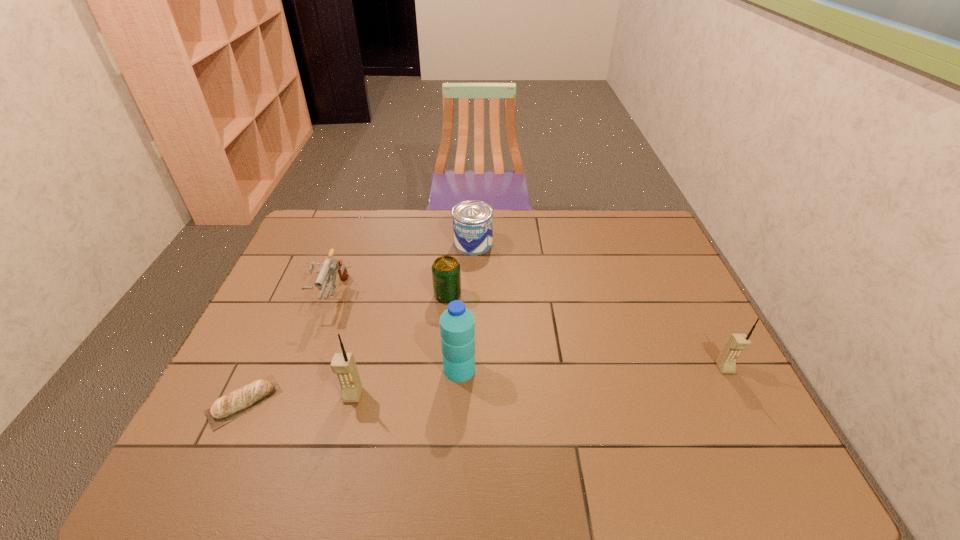
At what (x,y) coordinates should I click in order to perform the action: click on the left cellular telephone. Please return your answer as a coordinate pair (x, y). Looking at the image, I should click on (343, 364).

Image resolution: width=960 pixels, height=540 pixels. I want to click on the taller cellular telephone, so click(x=343, y=364).

This screenshot has width=960, height=540. Find the location of `the fifth shortest object`. the fifth shortest object is located at coordinates (726, 361).

The width and height of the screenshot is (960, 540). Find the location of `the shorter cellular telephone`. the shorter cellular telephone is located at coordinates (726, 361).

I want to click on beer can, so click(x=446, y=274).

The width and height of the screenshot is (960, 540). I want to click on gun, so click(329, 267).

Where is `can`? The width and height of the screenshot is (960, 540). can is located at coordinates (472, 220).

Find the location of a particular element. water bottle is located at coordinates (x=457, y=323).

Image resolution: width=960 pixels, height=540 pixels. What are the coordinates of `pita bread` in the screenshot? It's located at (226, 408).

You are a GUI agent. You are given a task and a screenshot of the screen. Output one action in this format:
    pyautogui.click(x=<x>, y=<y>)
    Task: Click on the vacant space located on the front of the nearer cellular telephone, where the keypad is located
    The image size is (960, 540).
    Given the screenshot: What is the action you would take?
    pyautogui.click(x=344, y=430)